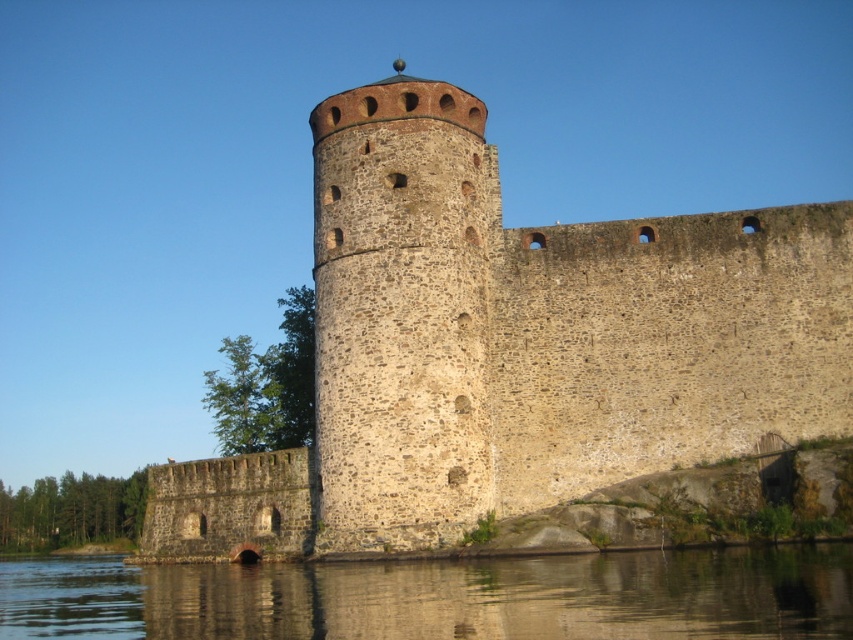
Question: Does stone tower at center appear over smooth water at lower center?

Choices:
 (A) yes
 (B) no

Answer: (A)

Question: In this image, where is stone wall at center located relative to smooth water at lower center?

Choices:
 (A) left
 (B) right

Answer: (B)

Question: Which point is closer to the camera?

Choices:
 (A) (537, 387)
 (B) (65, 584)

Answer: (A)

Question: Which of these objects is positioned farthest from the smooth water at lower center?

Choices:
 (A) stone wall at center
 (B) stone tower at center

Answer: (B)

Question: Which of the following is the closest to the observer?

Choices:
 (A) (323, 337)
 (B) (412, 260)

Answer: (B)

Question: From the image, what is the correct spatial relationship of stone wall at center in relation to smooth water at lower center?

Choices:
 (A) right
 (B) left

Answer: (A)